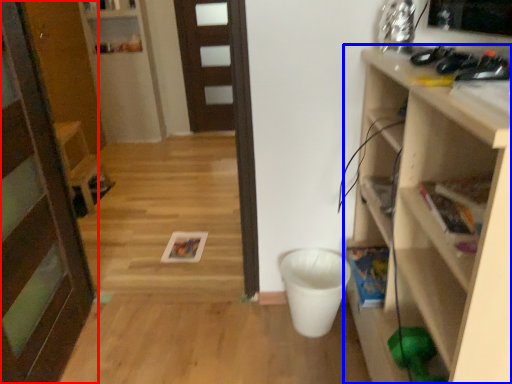
Question: Which of the following is the farthest to the observer, door (highlighted by a red box) or shelf (highlighted by a blue box)?

Choices:
 (A) door
 (B) shelf

Answer: (A)